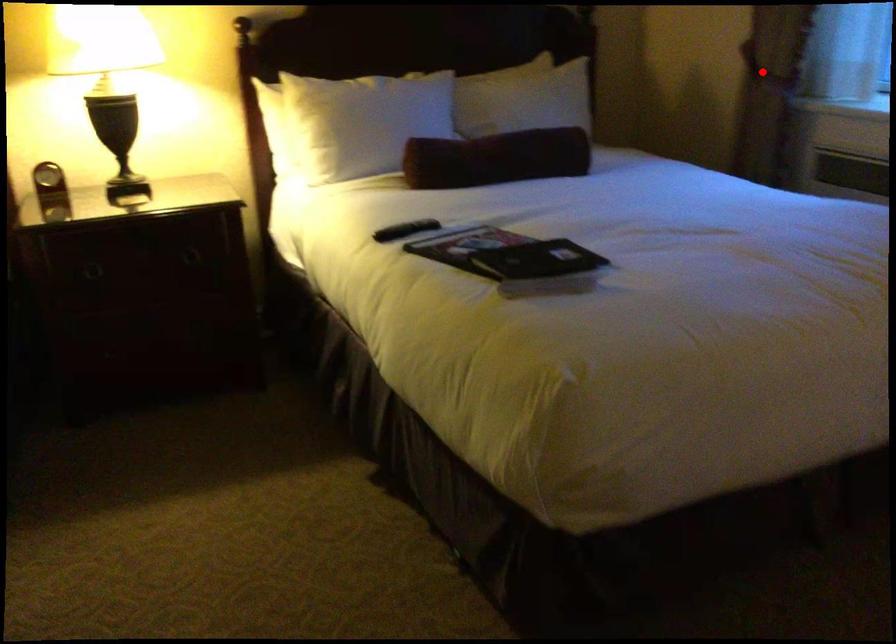
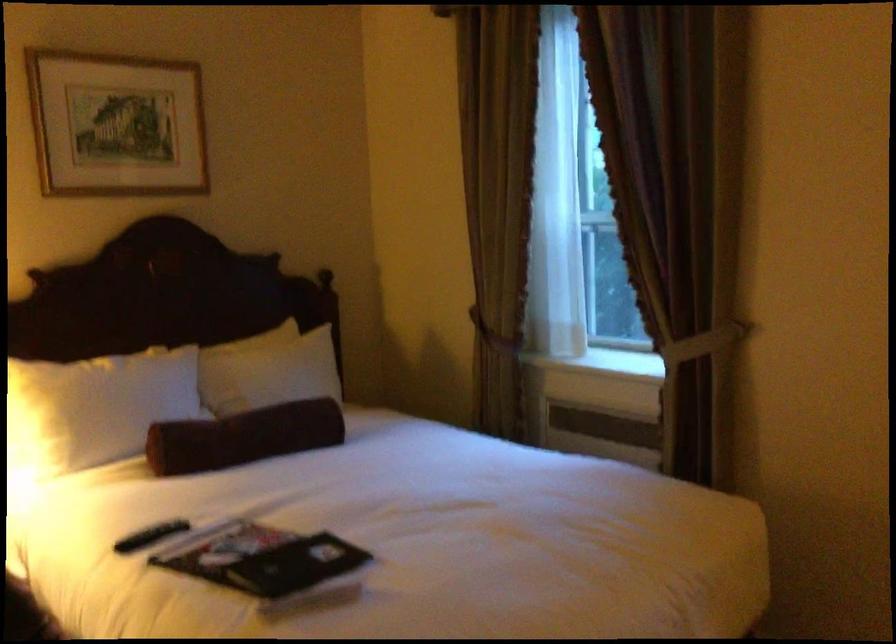
Where in the second image is the point corresponding to the highlighted location from the first image?

(494, 334)